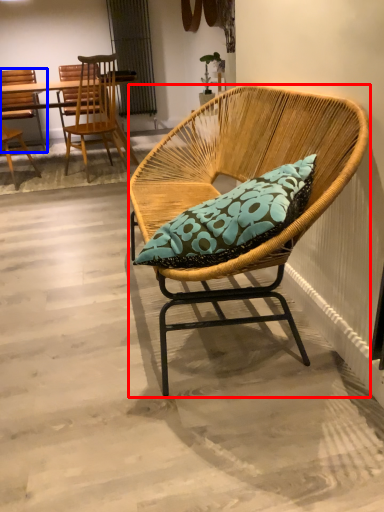
Question: Which of the following is the closest to the observer, chair (highlighted by a red box) or chair (highlighted by a blue box)?

Choices:
 (A) chair
 (B) chair

Answer: (A)